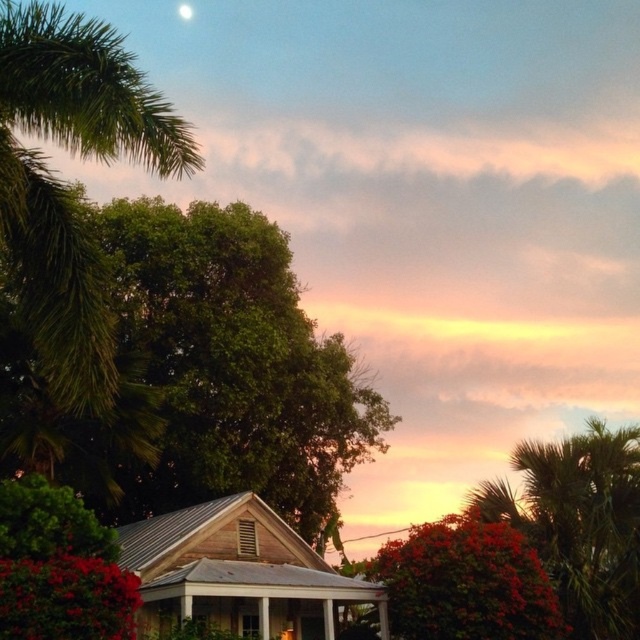
Who is more forward, (144,83) or (186,19)?

Point (144,83)

Which of these two, green leafy palm tree at upper left or white glossy moon at upper center, stands taller?

green leafy palm tree at upper left is taller.

Is point (49, 202) more distant than point (179, 6)?

No, it is not.

Find the location of a particular element. This screenshot has width=640, height=640. green leafy palm tree at upper left is located at coordinates (65, 184).

Is green leafy tree at upper left below green leafy palm tree at upper left?

Yes, green leafy tree at upper left is below green leafy palm tree at upper left.

Who is more forward, (166, 374) or (100, 360)?

Point (100, 360) is more forward.

Between point (157, 314) and point (100, 282), which one is positioned in front?

Point (100, 282) is more forward.

You are a GUI agent. You are given a task and a screenshot of the screen. Output one action in this format:
    pyautogui.click(x=<x>, y=<y>)
    Task: Click on the green leafy tree at upper left
    The width and height of the screenshot is (640, 640).
    Given the screenshot: What is the action you would take?
    pyautogui.click(x=196, y=376)

Can you confirm if green leafy tree at upper left is positioned to the right of wooden gazebo at center?

Incorrect, green leafy tree at upper left is not on the right side of wooden gazebo at center.

Does green leafy tree at upper left have a greater width compared to wooden gazebo at center?

Correct, the width of green leafy tree at upper left exceeds that of wooden gazebo at center.

This screenshot has width=640, height=640. Describe the element at coordinates (196, 376) in the screenshot. I see `green leafy tree at upper left` at that location.

Find the location of a particular element. green leafy tree at upper left is located at coordinates (196, 376).